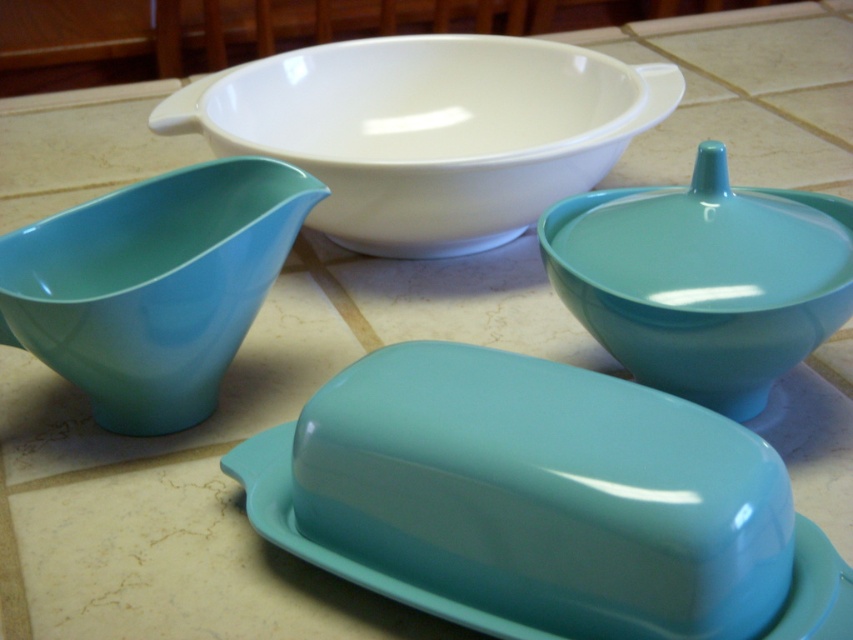
Question: Can you confirm if white glossy bowl at upper center is positioned to the left of matte turquoise bowl at upper right?

Choices:
 (A) yes
 (B) no

Answer: (A)

Question: Can you confirm if white glossy bowl at upper center is thinner than matte turquoise bowl at upper right?

Choices:
 (A) yes
 (B) no

Answer: (B)

Question: Which object appears closest to the camera in this image?

Choices:
 (A) mint glossy mixing bowl at left
 (B) matte turquoise bowl at upper right

Answer: (B)

Question: Is the position of mint glossy mixing bowl at left less distant than that of matte turquoise bowl at upper right?

Choices:
 (A) yes
 (B) no

Answer: (B)

Question: Which point appears closest to the camera in this image?

Choices:
 (A) (259, 77)
 (B) (100, 308)

Answer: (B)

Question: Which object is the closest to the mint glossy mixing bowl at left?

Choices:
 (A) white glossy bowl at upper center
 (B) matte turquoise bowl at upper right

Answer: (A)